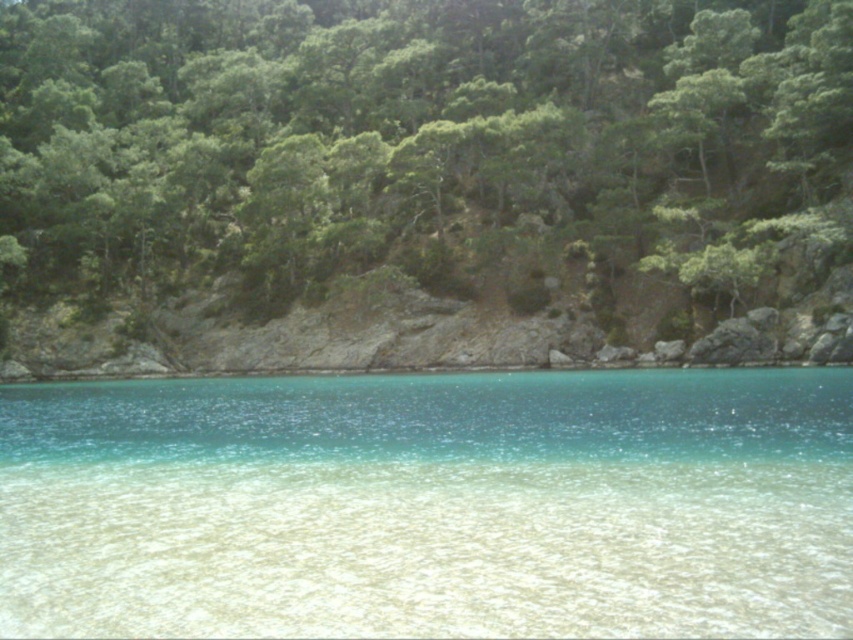
Who is more forward, (804,86) or (91,435)?

Point (91,435) is more forward.

Between point (468, 54) and point (437, 576), which one is positioned behind?

Positioned behind is point (468, 54).

Between point (543, 144) and point (119, 468), which one is positioned behind?

Positioned behind is point (543, 144).

Identify the location of green leafy trees at upper center. (398, 136).